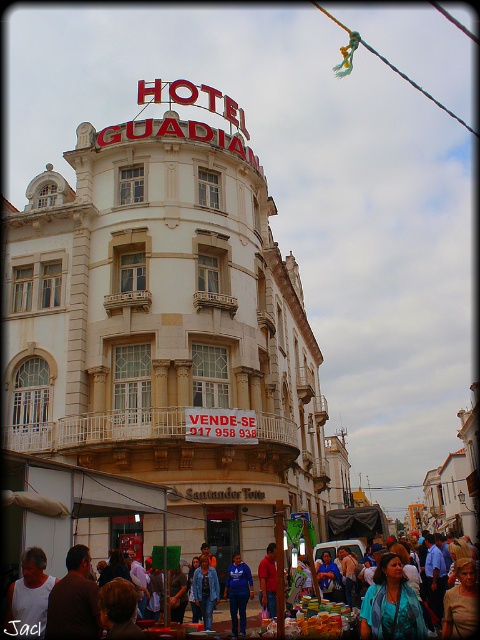
Question: Estimate the real-world distances between objects in this image. Which object is farther from the denim jacket at center?

Choices:
 (A) blue fabric shirt at center
 (B) red plastic sign at center

Answer: (B)

Question: Is blue denim jacket at center to the left of denim jacket at center from the viewer's perspective?

Choices:
 (A) yes
 (B) no

Answer: (B)

Question: Can you confirm if blue denim jacket at center is positioned to the right of blue fabric shirt at center?

Choices:
 (A) yes
 (B) no

Answer: (A)

Question: Among these points, which one is nearest to the camera?

Choices:
 (A) (56, 598)
 (B) (203, 602)
 (C) (420, 618)

Answer: (A)

Question: In this image, where is brown fabric shirt at lower left located relative to red plastic sign at center?

Choices:
 (A) right
 (B) left

Answer: (B)

Question: Which is farther from the teal satin blouse at center?

Choices:
 (A) red plastic sign at center
 (B) blue fabric shirt at center
 (C) blue denim jacket at center
 (D) white tank top at lower left

Answer: (A)